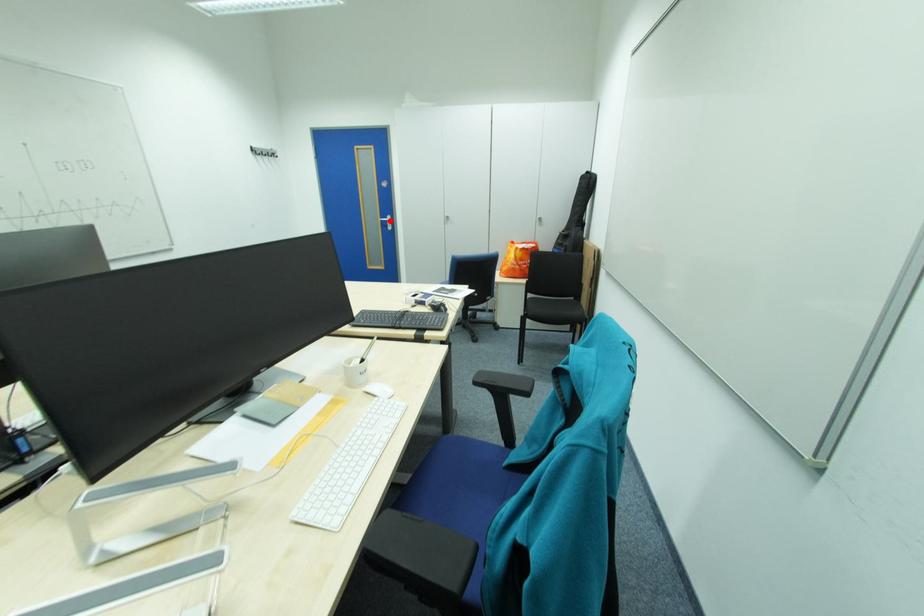
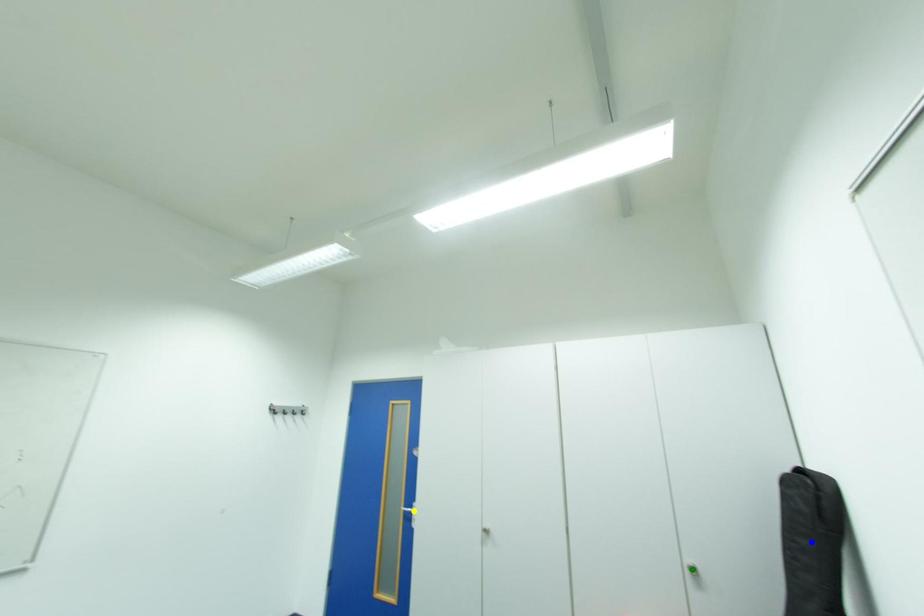
Question: I am providing you with two images of the same scene from different viewpoints. A red point is marked on the first image. You are given multiple points on the second image. Which point in image 2 represents the same 3d spot as the red point in image 1?

Choices:
 (A) blue point
 (B) green point
 (C) yellow point

Answer: (C)